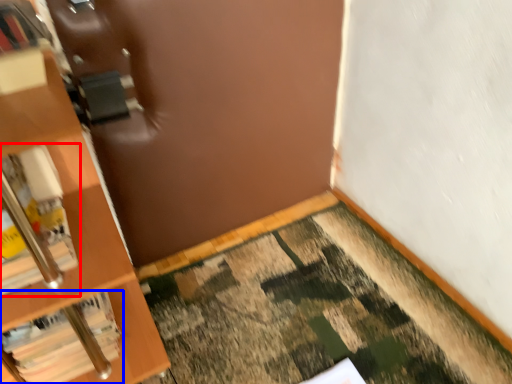
Question: Which of the following is the farthest to the observer, book (highlighted by a red box) or book (highlighted by a blue box)?

Choices:
 (A) book
 (B) book

Answer: (B)